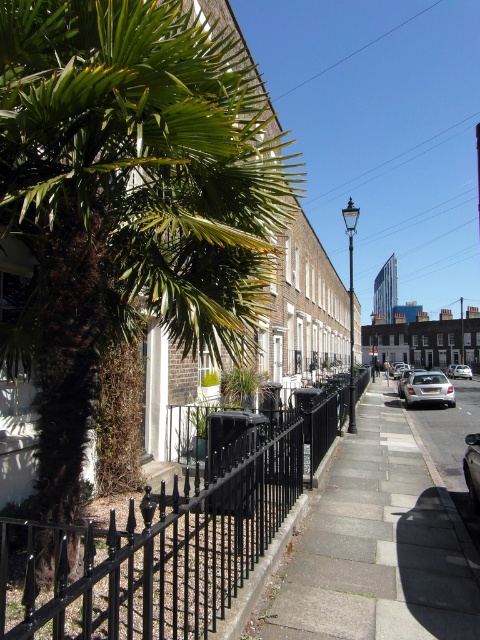
Does black wrought iron fence at center appear on the left side of silver metallic car at center-right?

Indeed, black wrought iron fence at center is positioned on the left side of silver metallic car at center-right.

Is point (92, 632) positioned after point (408, 376)?

No, it is in front of (408, 376).

You are a GUI agent. You are given a task and a screenshot of the screen. Output one action in this format:
    pyautogui.click(x=<x>, y=<y>)
    Task: Click on the black wrought iron fence at center
    This screenshot has width=480, height=640.
    Given the screenshot: What is the action you would take?
    pyautogui.click(x=170, y=536)

Does green leafy palm tree at left come behind black wrought iron fence at center?

That is True.

Where is `green leafy palm tree at left`? Image resolution: width=480 pixels, height=640 pixels. green leafy palm tree at left is located at coordinates (130, 196).

Is point (76, 392) positioned after point (141, 602)?

That is False.

Identify the location of green leafy palm tree at left. This screenshot has height=640, width=480. (130, 196).

Who is more forward, (113,93) or (445,396)?

Point (113,93) is in front.

Who is lower down, green leafy palm tree at left or silver metallic car at center-right?

Positioned lower is silver metallic car at center-right.

Where is `green leafy palm tree at left`? The width and height of the screenshot is (480, 640). green leafy palm tree at left is located at coordinates (130, 196).

Where is `green leafy palm tree at left`? The width and height of the screenshot is (480, 640). green leafy palm tree at left is located at coordinates pyautogui.click(x=130, y=196).